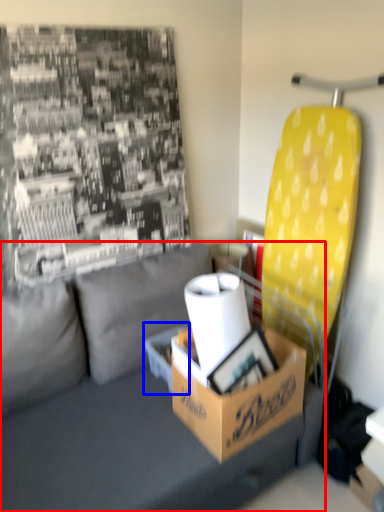
Question: Which object is closer to the camera taking this photo, studio couch (highlighted by a red box) or cardboard box (highlighted by a blue box)?

Choices:
 (A) studio couch
 (B) cardboard box

Answer: (A)